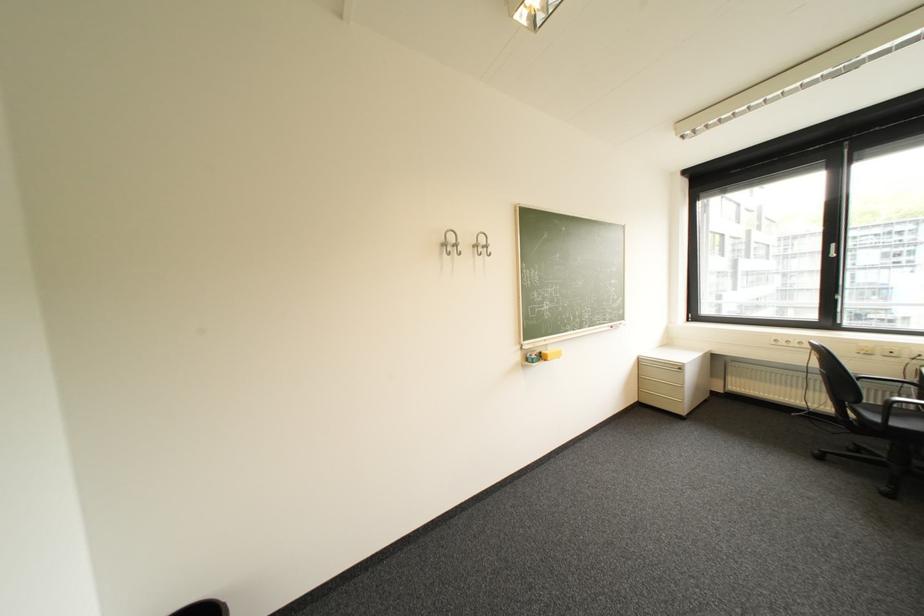
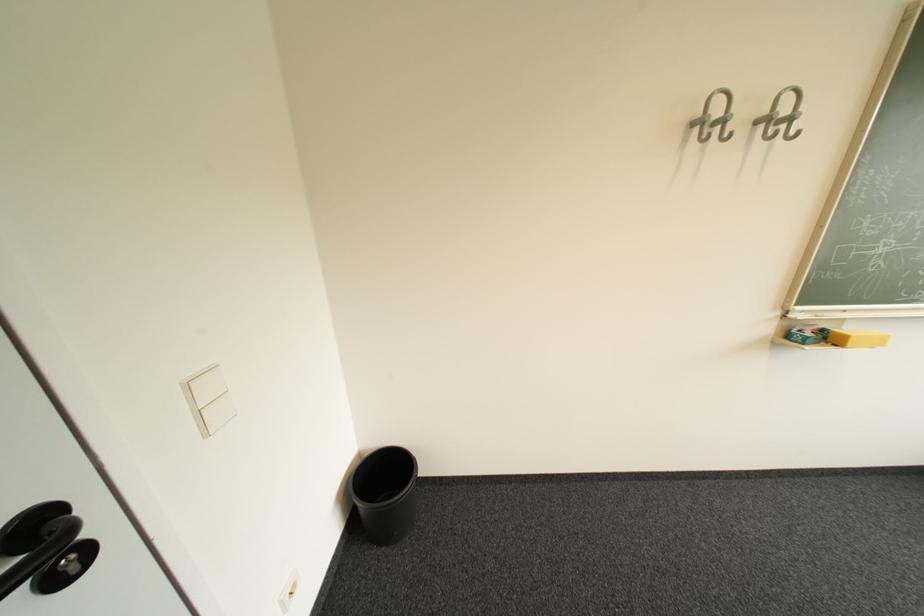
Where in the second image is the point corresponding to (485,243) from the first image?

(775, 113)